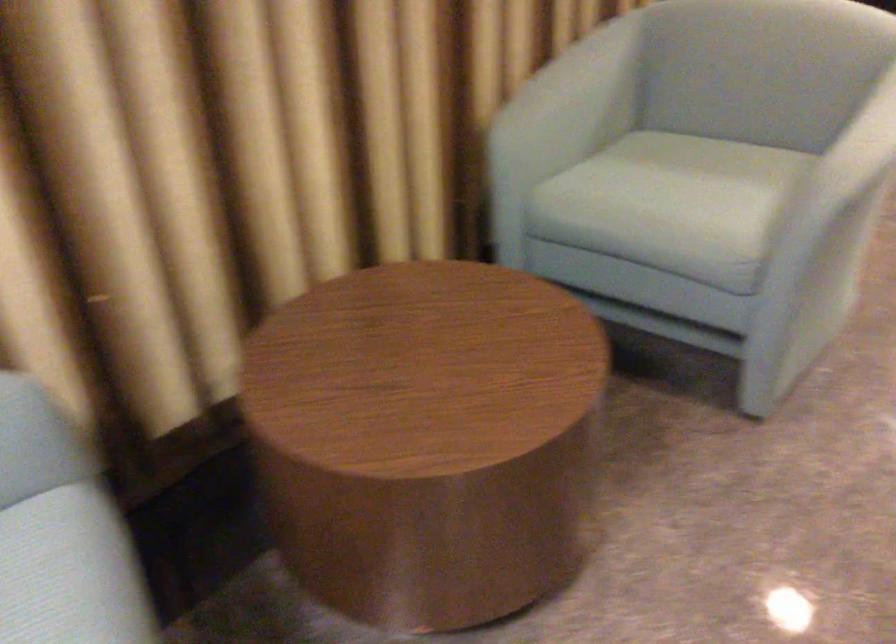
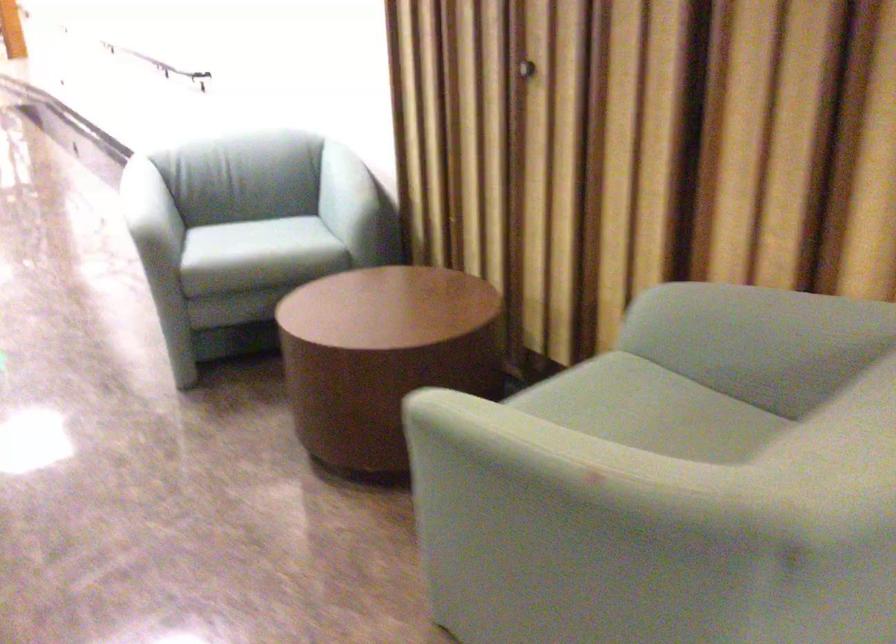
Find the pixel in the second image that matches [655,174] in the first image.

(650, 410)